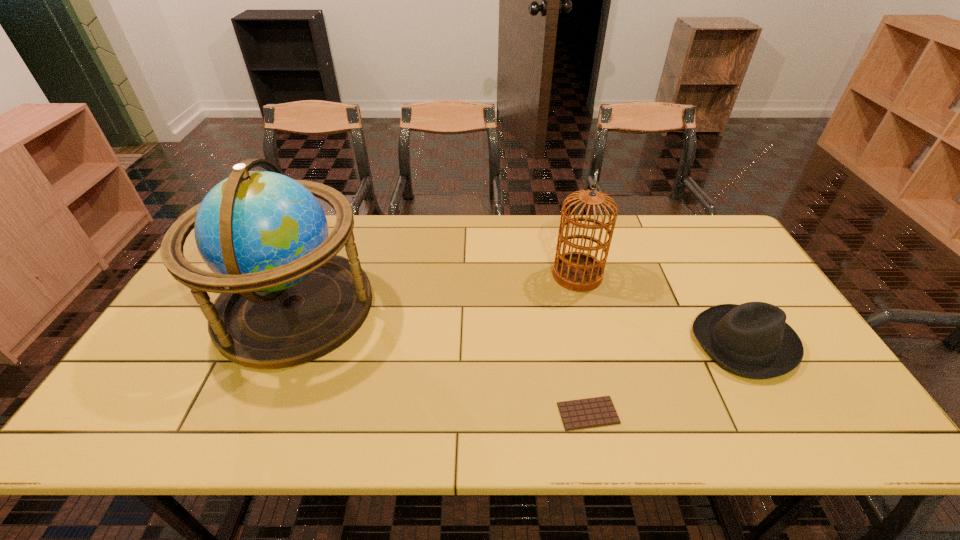
This screenshot has width=960, height=540. What are the coordinates of `free area in between the leftmost object and the third tallest object` in the screenshot? It's located at (519, 325).

Locate an element on the screen. object that is the third closest to the third tallest object is located at coordinates (286, 298).

Select which object is the second closest to the third tallest object. Please provide its 2D coordinates. Your answer should be formatted as a tuple, i.e. [(x, y)], where the tuple contains the x and y coordinates of a point satisfying the conditions above.

[(599, 411)]

Find the location of a particular element. vacant region that satisfies the following two spatial constraints: 1. on the back side of the tallest object; 2. on the right side of the third shortest object is located at coordinates click(308, 275).

Image resolution: width=960 pixels, height=540 pixels. I want to click on free spot that satisfies the following two spatial constraints: 1. on the front side of the second tallest object; 2. on the left side of the second shortest object, so click(594, 343).